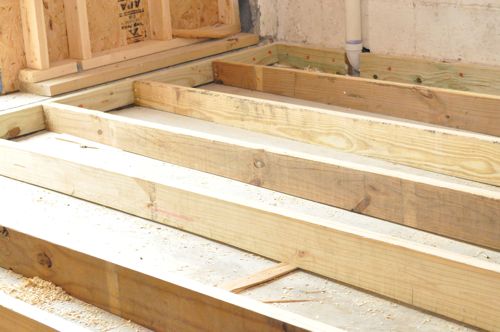
Identify the location of light grey shade. (465, 229).